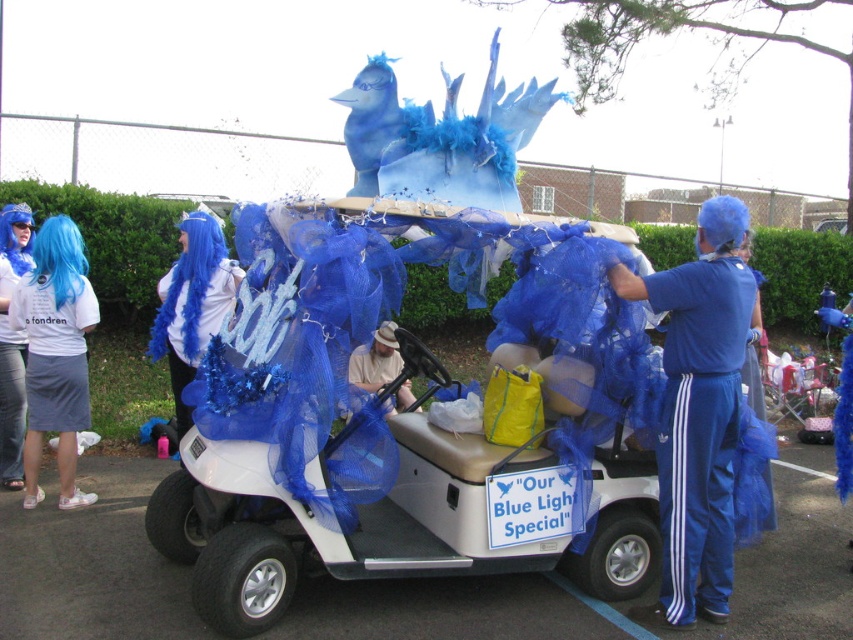
Question: Which point is farther to the camera?

Choices:
 (A) beige fabric hat at center
 (B) white matte golf cart at center
 (C) blue fabric wig at left
 (D) blue fluffy wig at upper left

Answer: (C)

Question: Is white fabric wig at upper left above blue fabric wig at left?

Choices:
 (A) no
 (B) yes

Answer: (A)

Question: Which of these objects is positioned closest to the white matte golf cart at center?

Choices:
 (A) blue fabric pants at right
 (B) blue fluffy wig at upper left
 (C) beige fabric hat at center

Answer: (A)

Question: Among these objects, which one is farthest from the camera?

Choices:
 (A) beige fabric hat at center
 (B) blue fabric pants at right
 (C) blue fluffy wig at upper left

Answer: (C)

Question: Is white matte golf cart at center bigger than blue silky wig at left?

Choices:
 (A) no
 (B) yes

Answer: (B)

Question: Is the position of blue fluffy wig at upper left less distant than that of blue fabric wig at left?

Choices:
 (A) yes
 (B) no

Answer: (A)